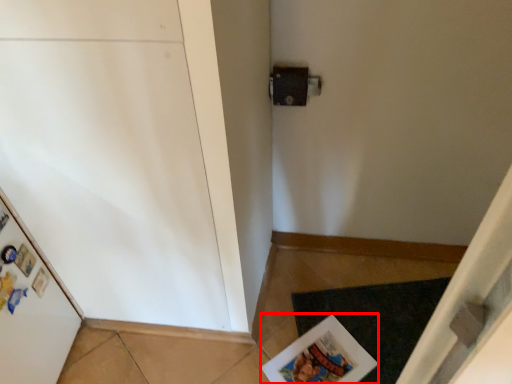
Question: From the image's perspective, where is magazine (annotated by the red box) located in relation to doormat in the image?

Choices:
 (A) below
 (B) above

Answer: (A)